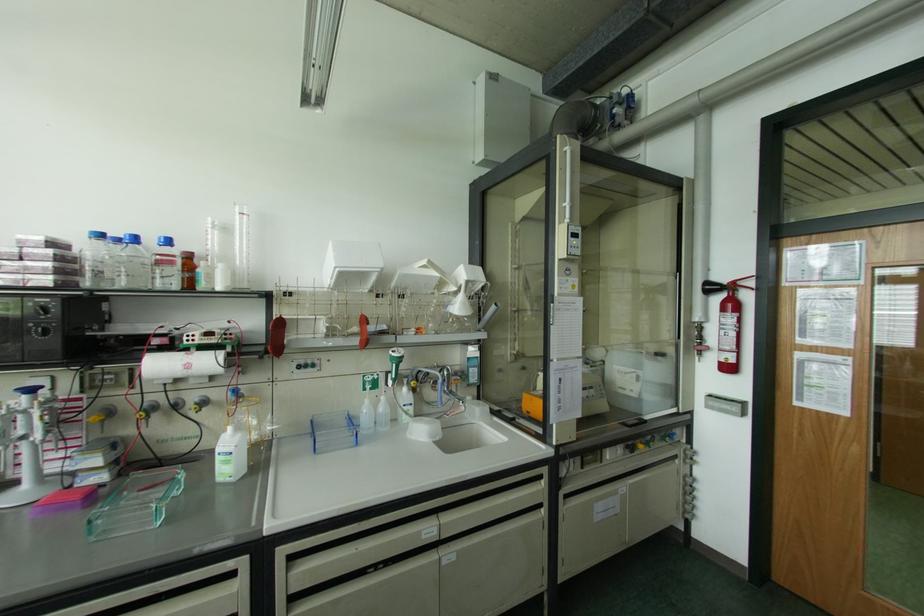
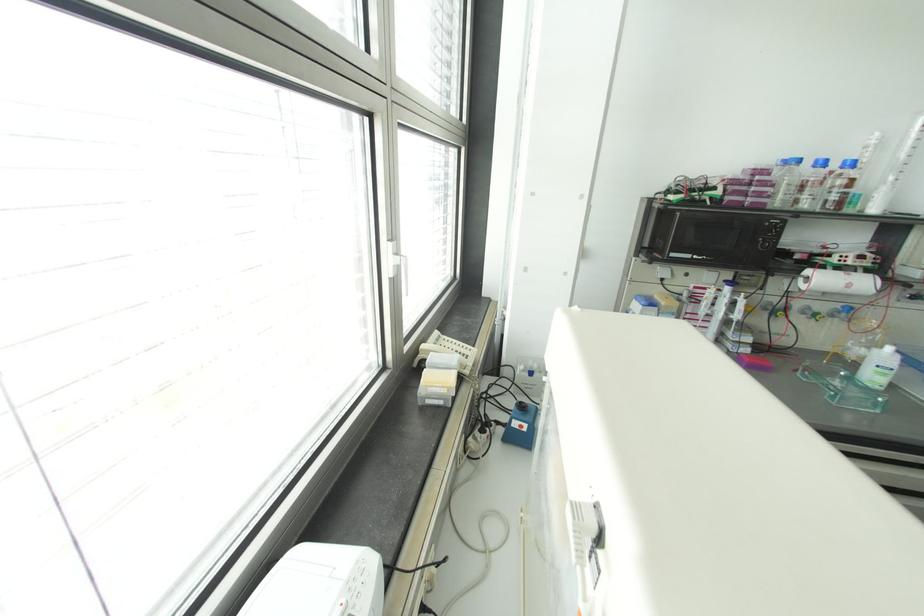
Where in the second image is the point corresponding to (101,236) from the first image?

(797, 160)